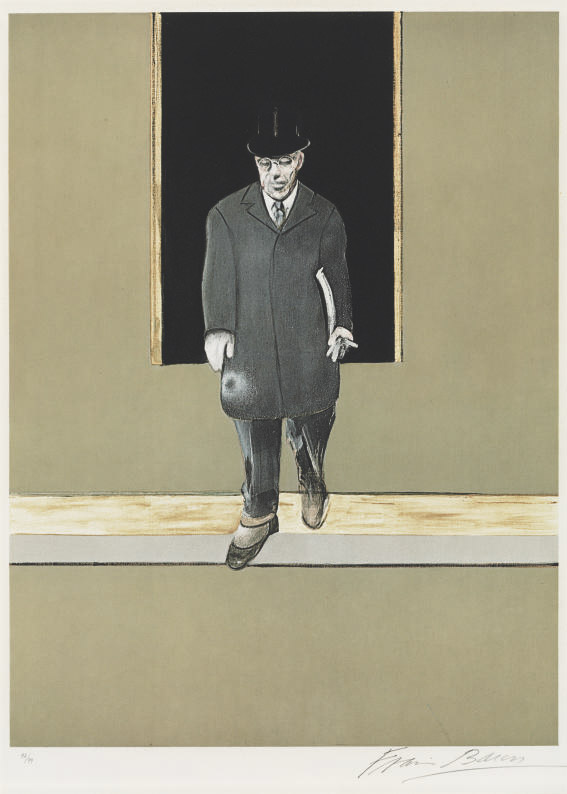
At what (x,y) coordinates should I click in order to perform the action: click on window. Please return your answer as a coordinate pair (x, y). The height and width of the screenshot is (794, 567). Looking at the image, I should click on (260, 86).